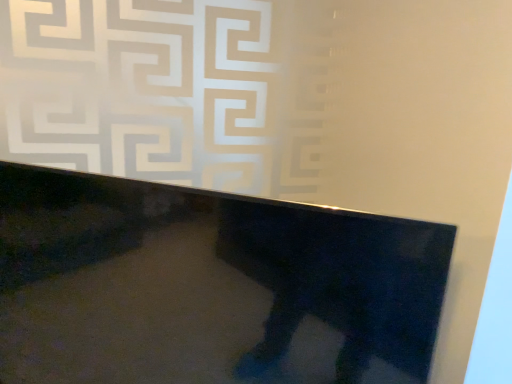
Describe the element at coordinates (208, 286) in the screenshot. I see `glossy black table at upper center` at that location.

In order to face glossy black table at upper center, should I rotate leftwards or rightwards?

Turn left by 12.776 degrees to look at glossy black table at upper center.

At what (x,y) coordinates should I click in order to perform the action: click on glossy black table at upper center. Please return your answer as a coordinate pair (x, y). This screenshot has width=512, height=384. Looking at the image, I should click on (208, 286).

The width and height of the screenshot is (512, 384). I want to click on glossy black table at upper center, so click(208, 286).